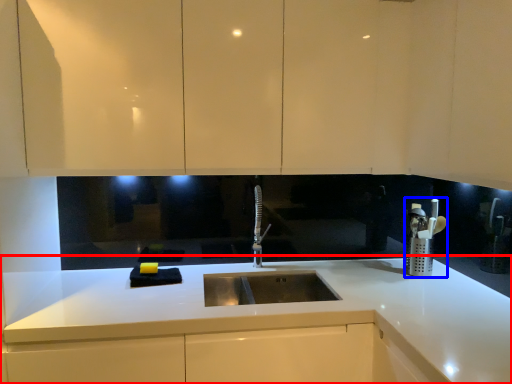
Question: Which object appears farthest to the camera in this image, countertop (highlighted by a red box) or appliance (highlighted by a blue box)?

Choices:
 (A) countertop
 (B) appliance

Answer: (B)